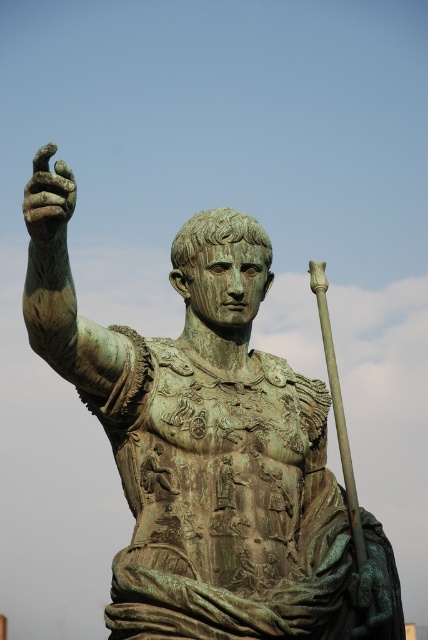
Can you confirm if green patina bronze statue at center is positioned above green patina hand at upper left?

No, green patina bronze statue at center is not above green patina hand at upper left.

Between point (344, 515) and point (36, 225), which one is positioned in front?

Positioned in front is point (36, 225).

Who is more distant from viewer, (121, 353) or (47, 243)?

The point (121, 353) is more distant.

Locate an element on the screen. green patina bronze statue at center is located at coordinates (216, 456).